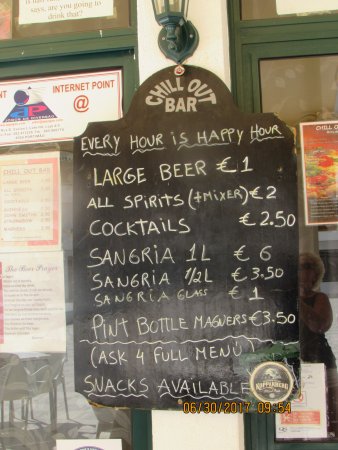
At what (x,y) coordinates should I click in order to perform the action: click on top windows. Please return your answer as a coordinate pair (x, y). This screenshot has height=450, width=338. Looking at the image, I should click on (105, 22), (261, 10).